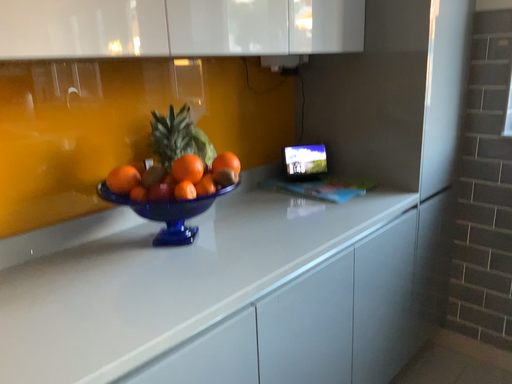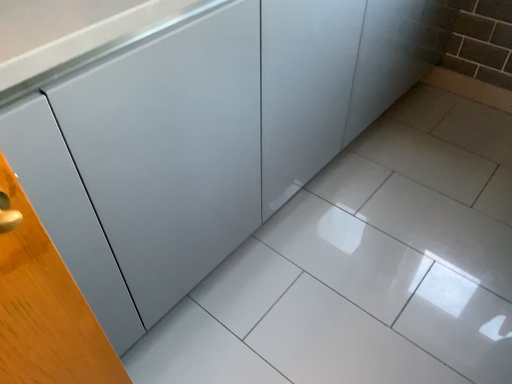
Question: Which way did the camera rotate in the video?

Choices:
 (A) rotated upward
 (B) rotated downward

Answer: (B)